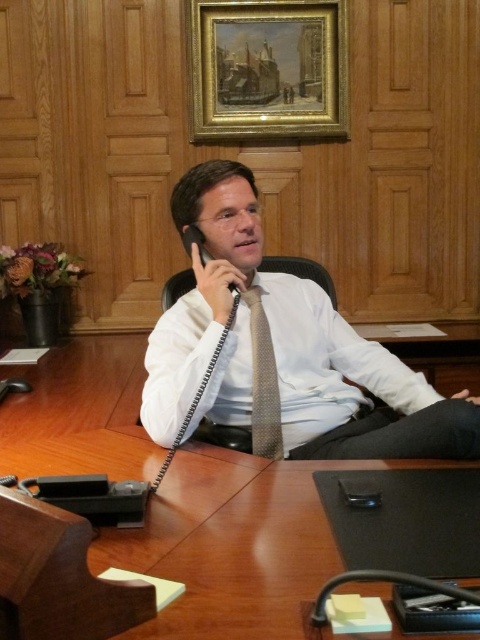
Question: Estimate the real-world distances between objects in this image. Which object is closer to the black plastic smartphone at lower center?

Choices:
 (A) white textured shirt at center
 (B) wooden table at center
 (C) black plastic phone at center
 (D) light brown textured tie at center

Answer: (D)

Question: Which point is closer to the camera?

Choices:
 (A) white textured shirt at center
 (B) wooden table at center
 (C) black plastic phone at center
 (D) light brown textured tie at center

Answer: (B)

Question: Where is white textured shirt at center located in relation to light brown textured tie at center in the image?

Choices:
 (A) left
 (B) right

Answer: (A)

Question: Which point is closer to the camera?

Choices:
 (A) (208, 259)
 (B) (348, 428)
 (C) (70, 344)

Answer: (B)

Question: Is the position of wooden table at center less distant than that of white textured shirt at center?

Choices:
 (A) no
 (B) yes

Answer: (B)

Question: Can you confirm if black plastic smartphone at lower center is bigger than black plastic phone at center?

Choices:
 (A) yes
 (B) no

Answer: (B)